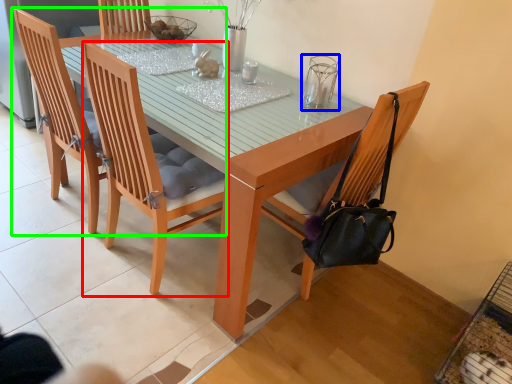
Question: Which is farther away from chair (highlighted by a red box)? clear (highlighted by a blue box) or chair (highlighted by a green box)?

Choices:
 (A) clear
 (B) chair

Answer: (A)